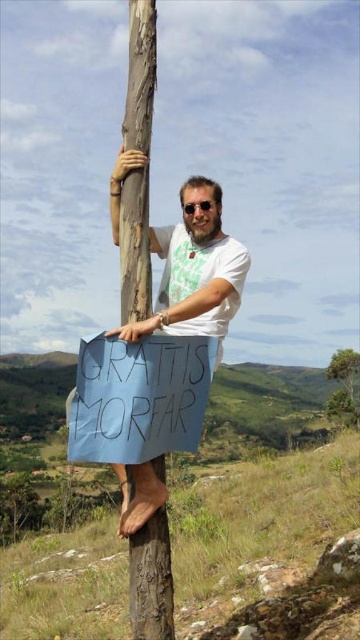
Between green leafy tree at lower left and green leafy tree at upper right, which one has more height?

green leafy tree at upper right

Does point (37, 496) come farther from viewer compared to point (357, 372)?

No, it is in front of (357, 372).

Is point (14, 536) closer to camera compared to point (357, 397)?

Yes, it is.

The width and height of the screenshot is (360, 640). Identify the location of green leafy tree at lower left. (16, 506).

Can you confirm if natural wood pole at center is shorter than green leafy tree at lower left?

Correct, natural wood pole at center is not as tall as green leafy tree at lower left.

Who is shorter, natural wood pole at center or green leafy tree at lower left?

natural wood pole at center is shorter.

Find the location of a particular element. natural wood pole at center is located at coordinates (x=150, y=580).

Locate an element on the screen. Image resolution: width=360 pixels, height=640 pixels. natural wood pole at center is located at coordinates (150, 580).

Consider the image. Is natural wood pole at center shorter than green leafy tree at upper right?

Indeed, natural wood pole at center has a lesser height compared to green leafy tree at upper right.

Describe the element at coordinates (150, 580) in the screenshot. I see `natural wood pole at center` at that location.

The height and width of the screenshot is (640, 360). Find the location of `natural wood pole at center`. natural wood pole at center is located at coordinates (150, 580).